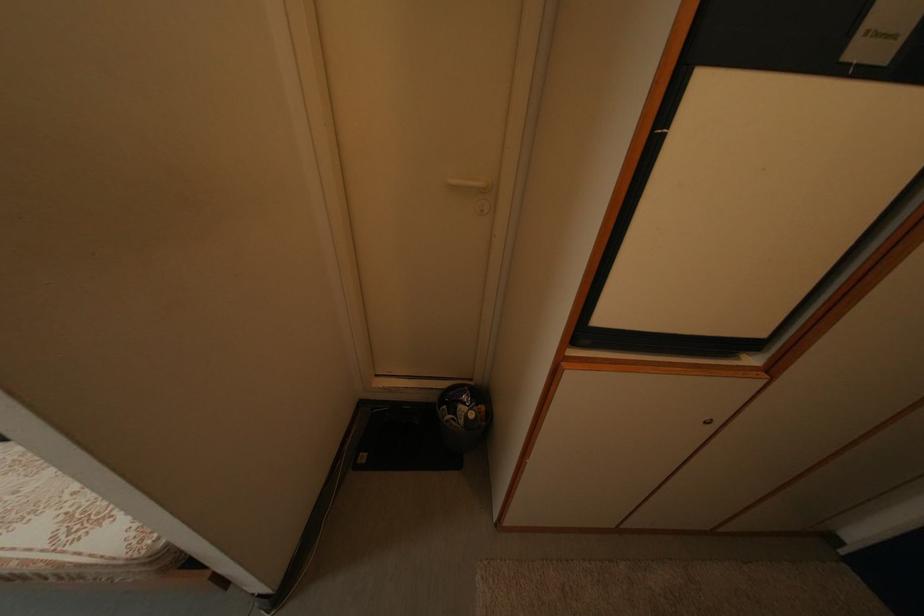
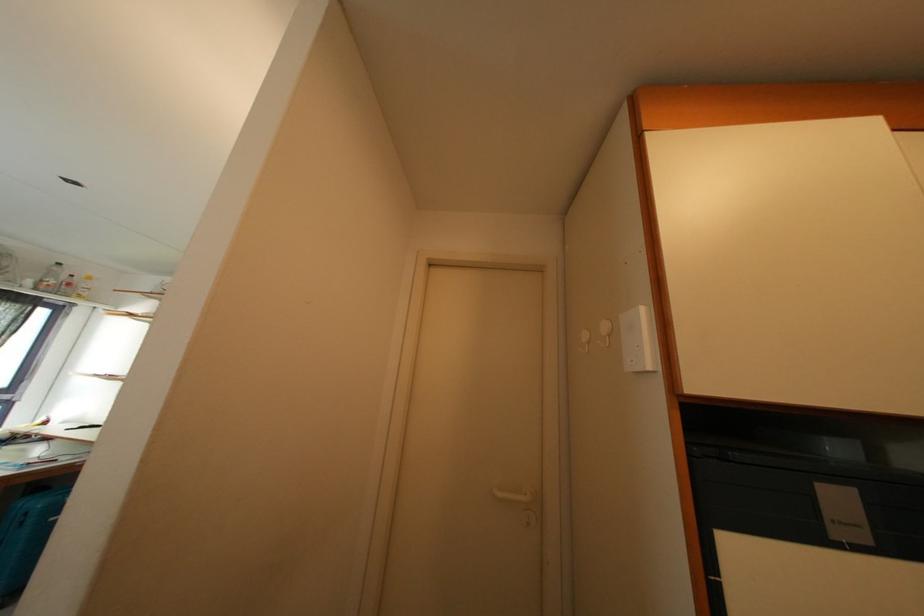
Question: The first image is from the beginning of the video and the second image is from the end. How did the camera likely rotate when shooting the video?

Choices:
 (A) Left
 (B) Right
 (C) Up
 (D) Down

Answer: (C)